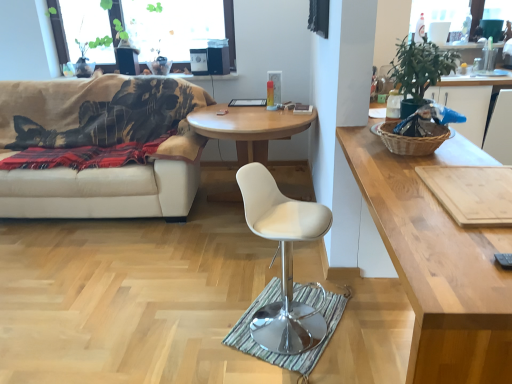
Image resolution: width=512 pixels, height=384 pixels. Identify the location of vacant space positioned to the left of wooden cutting board at right. (407, 200).